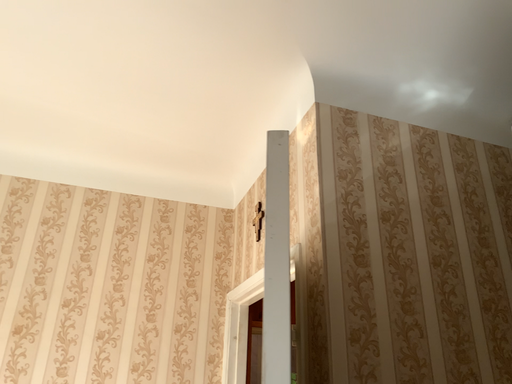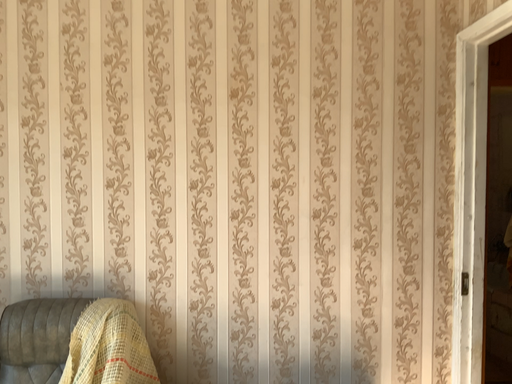
Question: Which way did the camera rotate in the video?

Choices:
 (A) rotated left
 (B) rotated right

Answer: (A)